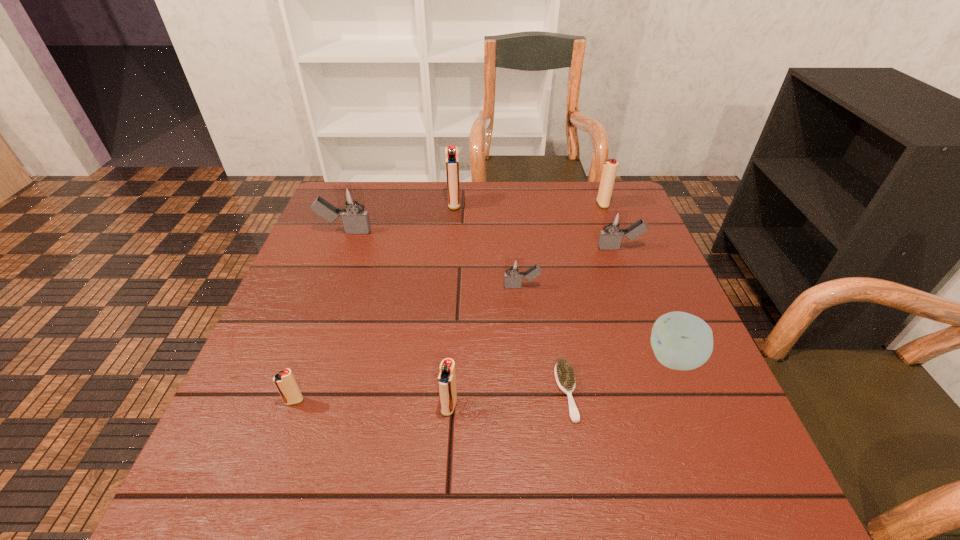
This screenshot has width=960, height=540. What are the coordinates of `the nearest gray igniter` in the screenshot? It's located at (514, 267).

This screenshot has height=540, width=960. In order to click on the third nearest igniter in this screenshot , I will do `click(514, 267)`.

Locate an element on the screen. Image resolution: width=960 pixels, height=540 pixels. scrubbing brush is located at coordinates (564, 374).

Find the location of a particular element. the shortest object is located at coordinates (564, 374).

Identify the location of free region located on the front of the tallest igniter. (448, 282).

I want to click on free space located 0.260m on the front of the second biggest red igniter, so click(626, 267).

This screenshot has width=960, height=540. In order to click on vacant space situated 0.310m on the front of the leftmost gray igniter in this screenshot , I will do click(308, 327).

You are a GUI agent. You are given a task and a screenshot of the screen. Output one action in this format:
    pyautogui.click(x=<x>, y=<y>)
    Task: Click on the free space located on the left of the fourth farthest igniter
    This screenshot has height=540, width=960.
    Given the screenshot: What is the action you would take?
    pyautogui.click(x=469, y=248)

Locate an element on the screen. Image resolution: width=960 pixels, height=540 pixels. vacant area situated 0.280m on the right of the third biggest red igniter is located at coordinates (608, 406).

Locate an element on the screen. vacant area located on the left of the apple is located at coordinates click(589, 359).